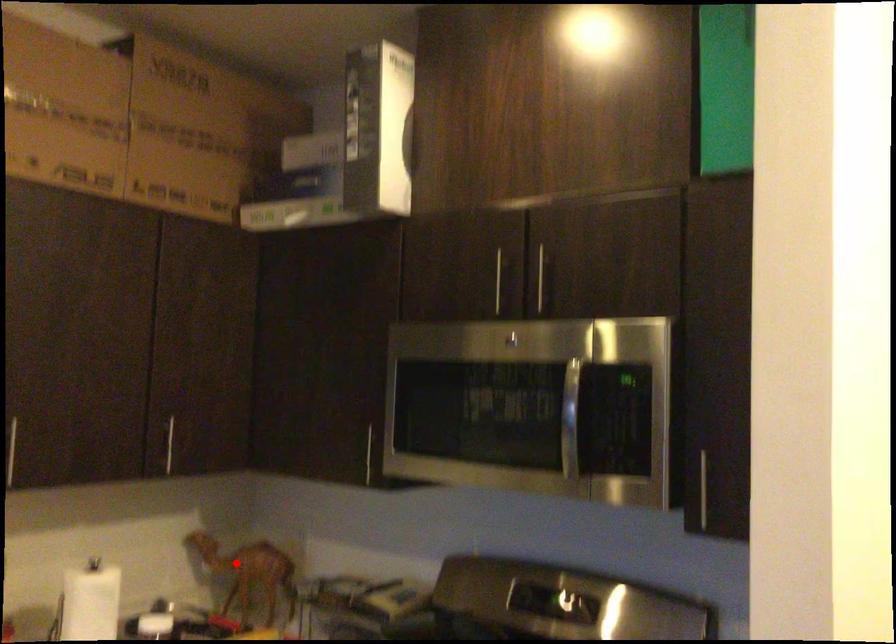
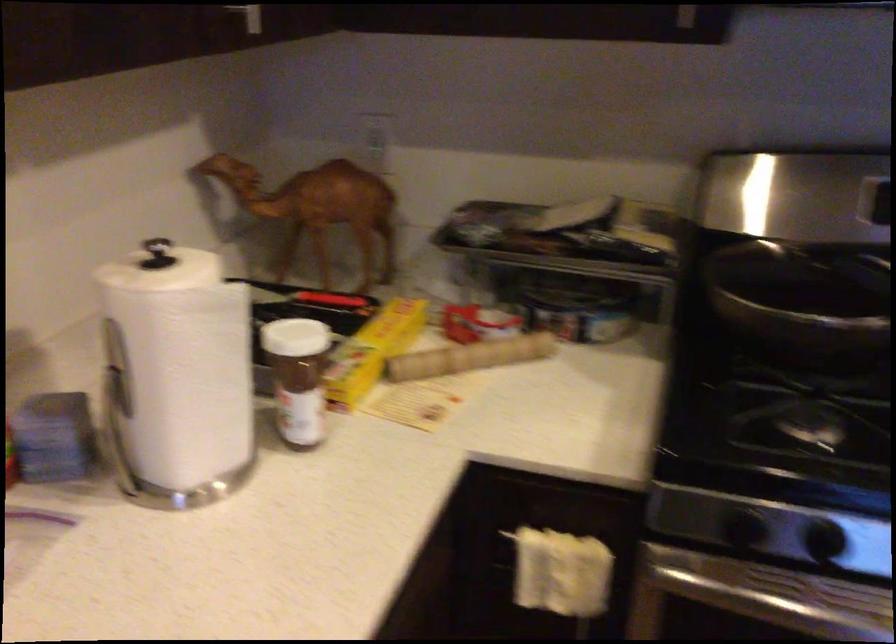
The point at the highlighted location is marked in the first image. Where is the corresponding point in the second image?

(317, 210)